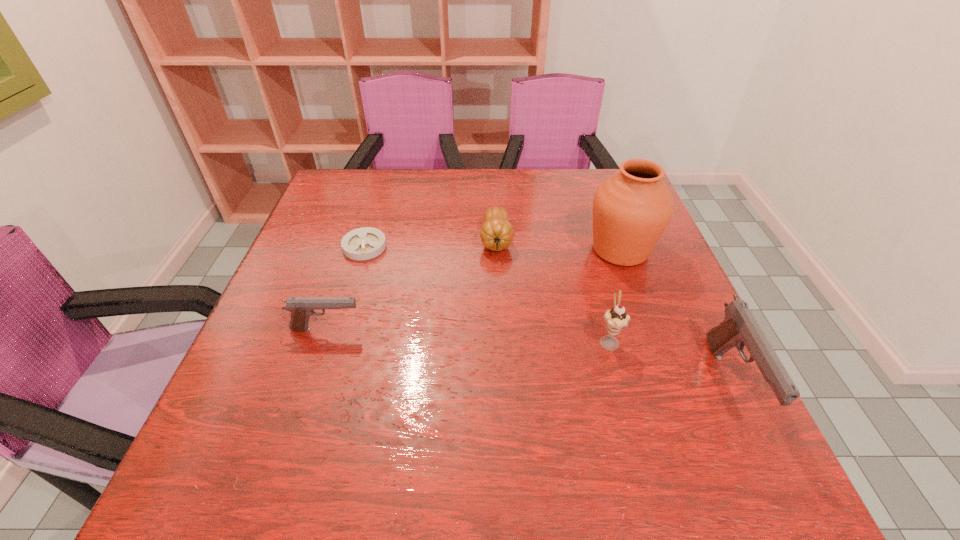
What are the coordinates of `vacant region at the left edge` in the screenshot? It's located at pyautogui.click(x=298, y=270).

Where is `free space at the right edge of the desktop`? This screenshot has width=960, height=540. free space at the right edge of the desktop is located at coordinates (670, 332).

In the image, there is a desktop. Where is `free space at the far left corner`? The image size is (960, 540). free space at the far left corner is located at coordinates (335, 177).

You are a GUI agent. You are given a task and a screenshot of the screen. Output one action in this format:
    pyautogui.click(x=<x>, y=<y>)
    Task: Click on the vacant space at the far right corner
    
    Given the screenshot: What is the action you would take?
    pyautogui.click(x=588, y=198)

This screenshot has height=540, width=960. In order to click on vacant area at the near right corner of the desktop in this screenshot , I will do `click(691, 410)`.

The height and width of the screenshot is (540, 960). What are the coordinates of `free space between the farther pistol and the icecream` in the screenshot? It's located at (468, 335).

Locate an element on the screen. This screenshot has width=960, height=540. empty location between the rightmost object and the icecream is located at coordinates (670, 361).

Image resolution: width=960 pixels, height=540 pixels. I want to click on free spot between the nearer pistol and the left pistol, so click(529, 356).

This screenshot has height=540, width=960. I want to click on free spot between the taller pistol and the icecream, so click(x=670, y=361).

Locate an element on the screen. This screenshot has width=960, height=540. vacant area that lies between the fourth object from right to left and the icecream is located at coordinates pyautogui.click(x=552, y=291).